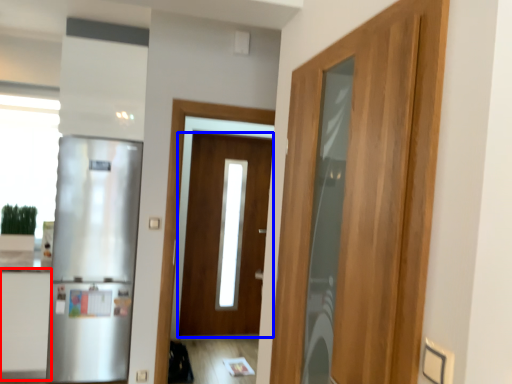
Question: Among these objects, which one is farthest to the camera, cabinetry (highlighted by a red box) or door (highlighted by a blue box)?

Choices:
 (A) cabinetry
 (B) door

Answer: (B)